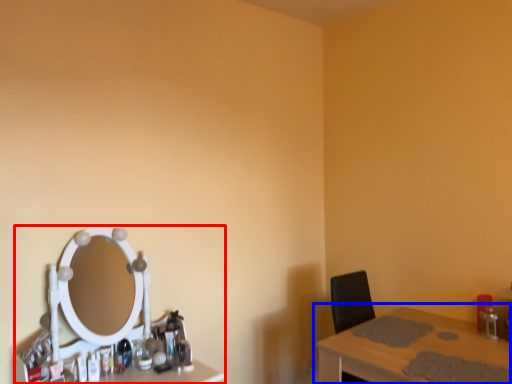
Question: Which of the following is the farthest to the observer, computer desk (highlighted by a red box) or table (highlighted by a blue box)?

Choices:
 (A) computer desk
 (B) table

Answer: (A)